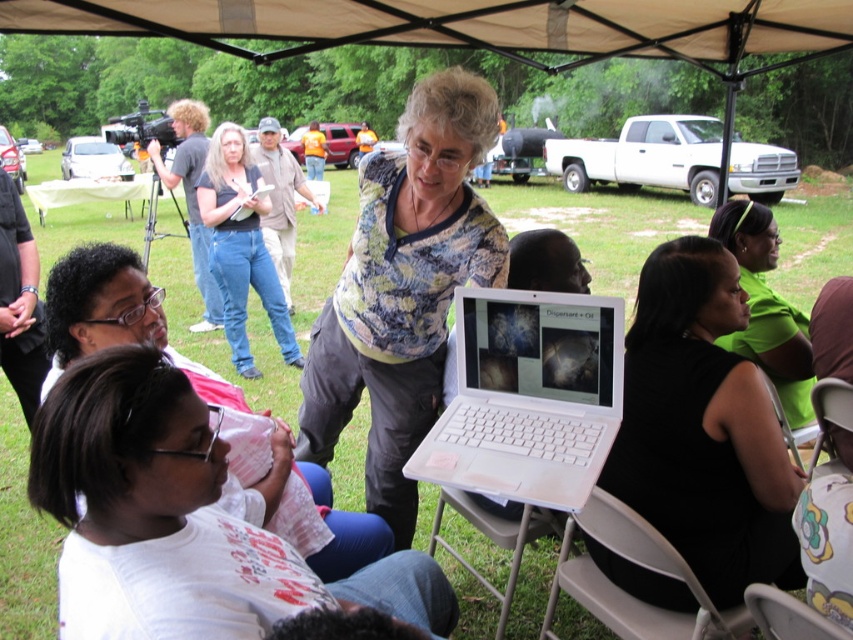
Describe the element at coordinates (703, 428) in the screenshot. I see `black fabric dress at center` at that location.

Between point (737, 573) and point (670, 616), which one is positioned in front?

Positioned in front is point (737, 573).

Image resolution: width=853 pixels, height=640 pixels. What are the coordinates of `black fabric dress at center` in the screenshot? It's located at (703, 428).

Can you confirm if white matte shirt at center is positioned below gray plastic chair at lower center?

Actually, white matte shirt at center is above gray plastic chair at lower center.

Between white matte shirt at center and gray plastic chair at lower center, which one has less height?

gray plastic chair at lower center

I want to click on white matte shirt at center, so click(x=114, y=314).

This screenshot has width=853, height=640. In order to click on white matte shirt at center in this screenshot , I will do `click(114, 314)`.

Is white matte shirt at center in front of beige fabric folding chair at lower center?

Yes.

Does white matte shirt at center appear under beige fabric folding chair at lower center?

No.

The width and height of the screenshot is (853, 640). Describe the element at coordinates (114, 314) in the screenshot. I see `white matte shirt at center` at that location.

Find the location of `white matte shirt at center`. white matte shirt at center is located at coordinates (114, 314).